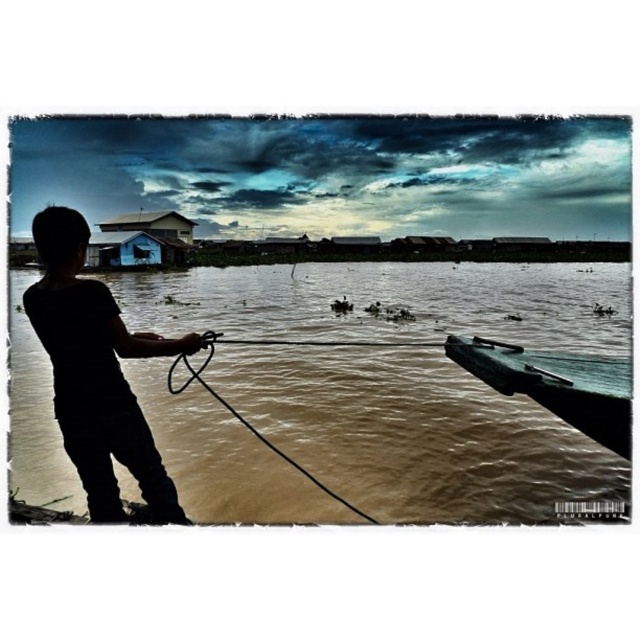
Can you confirm if brown muddy water at lower left is positioned to the right of silhouette boy at left?

Correct, you'll find brown muddy water at lower left to the right of silhouette boy at left.

Which is below, brown muddy water at lower left or silhouette boy at left?

silhouette boy at left is lower down.

Between point (305, 333) and point (157, 468), which one is positioned in front?

Point (157, 468)

At what (x,y) coordinates should I click in order to perform the action: click on brown muddy water at lower left. Please return your answer as a coordinate pair (x, y). This screenshot has height=640, width=640. Looking at the image, I should click on (413, 433).

Can you confirm if silhouette boy at left is shorter than green matte boat at lower right?

In fact, silhouette boy at left may be taller than green matte boat at lower right.

Locate an element on the screen. The width and height of the screenshot is (640, 640). silhouette boy at left is located at coordinates (97, 372).

This screenshot has width=640, height=640. In order to click on silhouette boy at left in this screenshot , I will do `click(97, 372)`.

Can you confirm if brown muddy water at lower left is positioned to the right of green matte boat at lower right?

No, brown muddy water at lower left is not to the right of green matte boat at lower right.

What do you see at coordinates (413, 433) in the screenshot? The image size is (640, 640). I see `brown muddy water at lower left` at bounding box center [413, 433].

Is point (294, 428) closer to camera compared to point (460, 358)?

No.

In order to click on brown muddy water at lower left in this screenshot , I will do `click(413, 433)`.